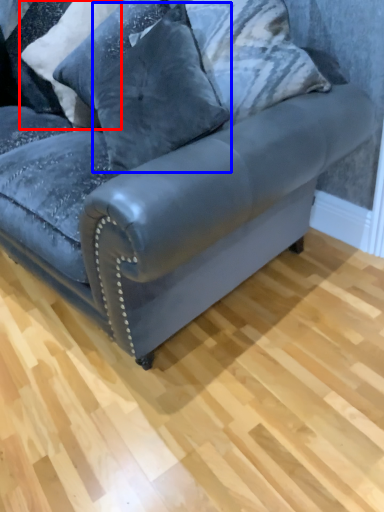
Question: Which of the following is the closest to the observer, pillow (highlighted by a red box) or pillow (highlighted by a blue box)?

Choices:
 (A) pillow
 (B) pillow

Answer: (B)